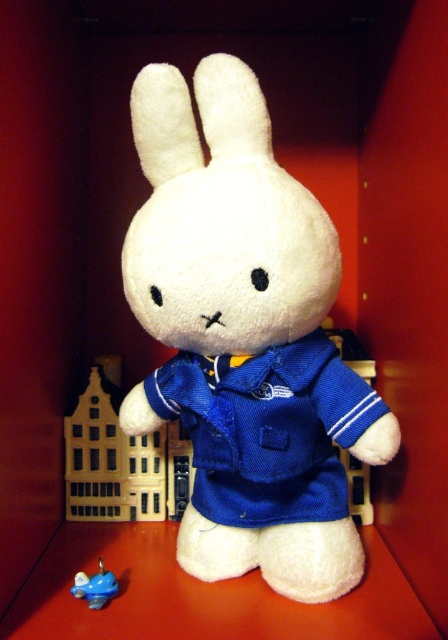
Image resolution: width=448 pixels, height=640 pixels. What do you see at coordinates (245, 339) in the screenshot?
I see `white plush rabbit at center` at bounding box center [245, 339].

Can you confirm if white plush rabbit at center is shorter than blue rubber duck at lower left?

No, white plush rabbit at center is not shorter than blue rubber duck at lower left.

The width and height of the screenshot is (448, 640). In order to click on white plush rabbit at center in this screenshot , I will do `click(245, 339)`.